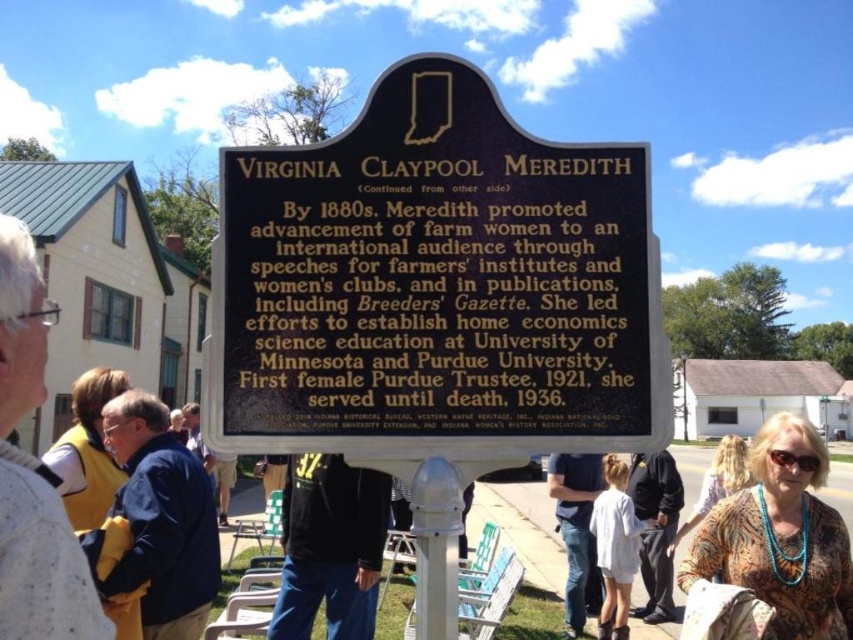
You are a tour guide explaining the historical marker plaque to visitors. You notice a black polished stone sign at center and denim jeans at center. Which object is wider?

The black polished stone sign at center is wider than the denim jeans at center, as its width surpasses the jeans.

You are a fashion designer observing the image of Virginia Claypool Meredith. You notice the denim jeans at center and the printed floral blouse at center. Which clothing item appears shorter in the image?

The denim jeans at center has a lesser height compared to the printed floral blouse at center, so the denim jeans at center appears shorter.

You are an artist creating a detailed sketch of the historical marker plaque. You notice the turquoise beaded necklace at center and the yellow fabric jacket at lower left. Which object should you draw first if you want to ensure proper proportions based on their sizes?

The turquoise beaded necklace at center should be drawn first because it has a larger size compared to the yellow fabric jacket at lower left, ensuring proper proportions.